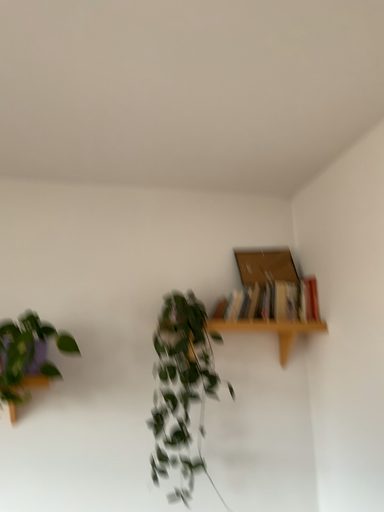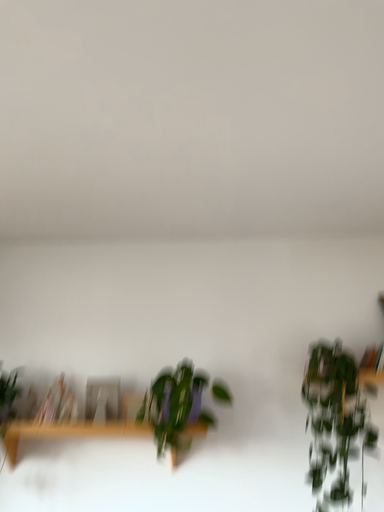
Question: How did the camera likely rotate when shooting the video?

Choices:
 (A) rotated left
 (B) rotated right

Answer: (A)